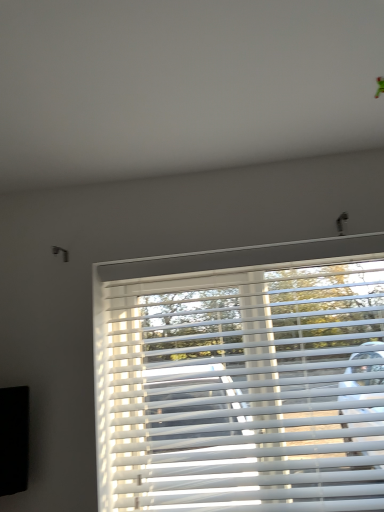
This screenshot has width=384, height=512. I want to click on white plastic blinds at center, so click(x=242, y=378).

What do you see at coordinates (242, 378) in the screenshot? I see `white plastic blinds at center` at bounding box center [242, 378].

Find the location of a particular element. The width and height of the screenshot is (384, 512). white plastic blinds at center is located at coordinates (242, 378).